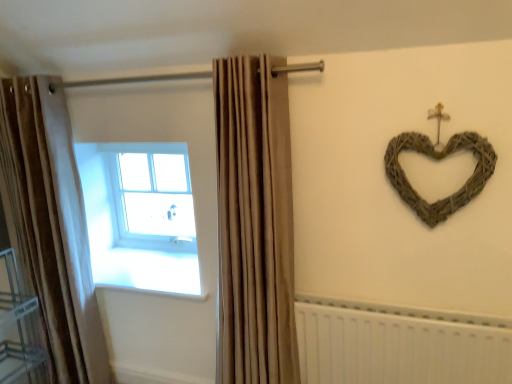
Question: Can you confirm if white glass window at upper left is thinner than woven natural heart at upper right?

Choices:
 (A) yes
 (B) no

Answer: (B)

Question: Is there a large distance between white glass window at upper left and woven natural heart at upper right?

Choices:
 (A) yes
 (B) no

Answer: (A)

Question: From the image's perspective, is white glass window at upper left on woven natural heart at upper right?

Choices:
 (A) no
 (B) yes

Answer: (A)

Question: Does white glass window at upper left lie behind woven natural heart at upper right?

Choices:
 (A) yes
 (B) no

Answer: (A)

Question: From the image's perspective, is white glass window at upper left under woven natural heart at upper right?

Choices:
 (A) no
 (B) yes

Answer: (B)

Question: Is woven natural heart at upper right situated inside beige velvet curtain at left, the 2th curtain in the right-to-left sequence, or outside?

Choices:
 (A) outside
 (B) inside

Answer: (A)

Question: Is point (402, 139) positioned closer to the camera than point (77, 302)?

Choices:
 (A) farther
 (B) closer

Answer: (B)

Question: From their relative heights in the image, would you say woven natural heart at upper right is taller or shorter than beige velvet curtain at left, the 2th curtain in the right-to-left sequence?

Choices:
 (A) tall
 (B) short

Answer: (B)

Question: In the image, is woven natural heart at upper right on the left side or the right side of beige velvet curtain at left, the 2th curtain in the right-to-left sequence?

Choices:
 (A) left
 (B) right

Answer: (B)

Question: Would you say white plastic radiator at lower right is to the left or to the right of white glass window at upper left in the picture?

Choices:
 (A) left
 (B) right

Answer: (B)

Question: Is white plastic radiator at lower right bigger or smaller than white glass window at upper left?

Choices:
 (A) big
 (B) small

Answer: (B)

Question: Looking at their shapes, would you say white plastic radiator at lower right is wider or thinner than white glass window at upper left?

Choices:
 (A) wide
 (B) thin

Answer: (B)

Question: From the image's perspective, is white plastic radiator at lower right located above or below white glass window at upper left?

Choices:
 (A) above
 (B) below

Answer: (B)

Question: Based on their sizes in the image, would you say white glass window at upper left is bigger or smaller than white plastic radiator at lower right?

Choices:
 (A) big
 (B) small

Answer: (A)

Question: Looking at their shapes, would you say white glass window at upper left is wider or thinner than white plastic radiator at lower right?

Choices:
 (A) thin
 (B) wide

Answer: (B)